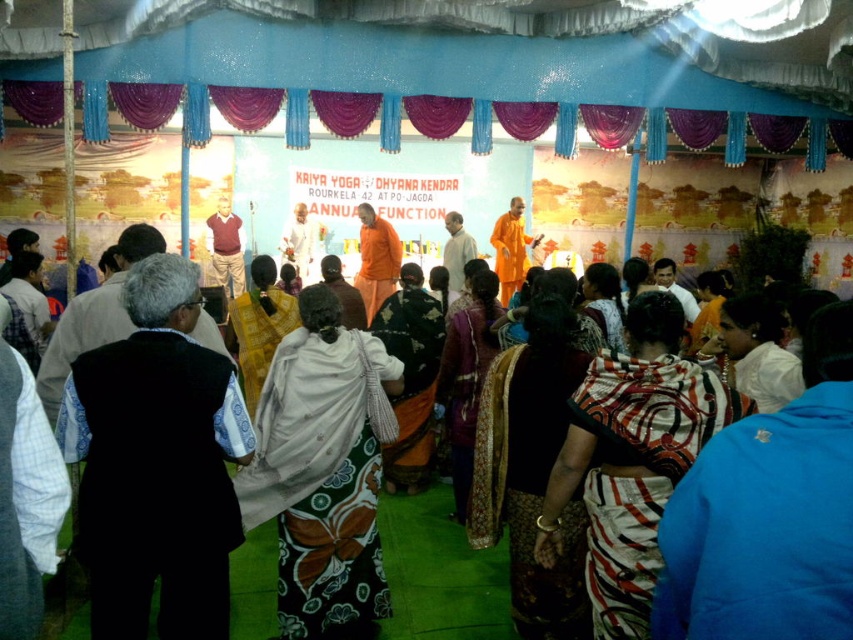
Question: Which of the following is the closest to the observer?

Choices:
 (A) blue cotton robe at lower right
 (B) white cotton saree at center

Answer: (A)

Question: Is printed cotton saree at center positioned in front of printed silk sari at center?

Choices:
 (A) no
 (B) yes

Answer: (B)

Question: Is white textured cloth at center wider than orange cotton robe at center?

Choices:
 (A) no
 (B) yes

Answer: (B)

Question: Among these points, which one is nearest to the camera?

Choices:
 (A) (724, 452)
 (B) (112, 502)

Answer: (A)

Question: Is orange cloth at center to the left of maroon fabric robe at center from the viewer's perspective?

Choices:
 (A) no
 (B) yes

Answer: (A)

Question: Which point is farther to the camera?

Choices:
 (A) white cotton saree at center
 (B) orange cotton robe at center
 (C) white textured cloth at center
 (D) printed silk sari at center

Answer: (B)